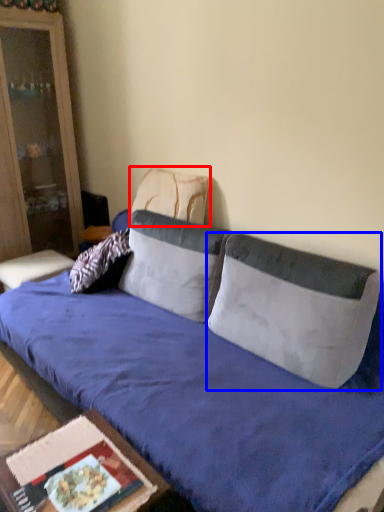
Question: Which object appears closest to the camera in this image, pillow (highlighted by a red box) or pillow (highlighted by a blue box)?

Choices:
 (A) pillow
 (B) pillow

Answer: (B)